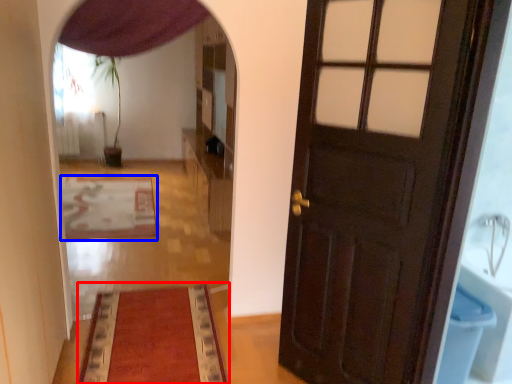
Question: Which object is closer to the camera taking this photo, mat (highlighted by a red box) or mat (highlighted by a blue box)?

Choices:
 (A) mat
 (B) mat

Answer: (A)